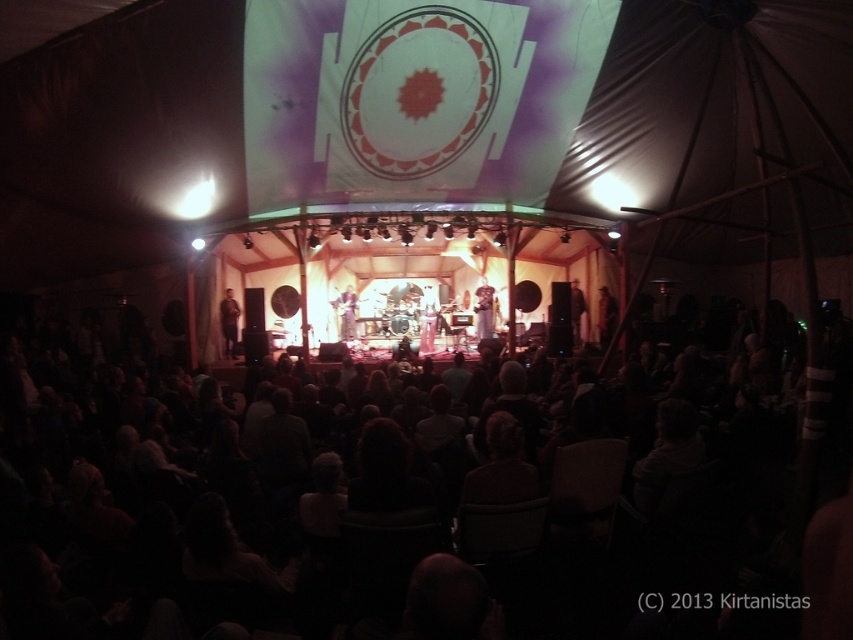
You are a photographer at the concert and want to capture a photo of the silky white dress at center without the dark fabric chairs at center blocking it. Can you move closer to the dress to ensure it fills the frame while avoiding the chairs?

The dark fabric chairs at center are wider than the silky white dress at center, so moving closer might still allow the dress to be framed without the chairs blocking it if positioned correctly.

You are standing at the front of the indoor concert venue and want to take a photo. There are two points of interest marked as point (461, 465) and point (350, 323). Which point is closer to your camera position?

Point (461, 465) is closer to the camera than point (350, 323).

You are a photographer positioned at the back of the audience, aiming to capture a clear shot of both the matte black guitar at left and the silky white dress at center. Which object will appear taller in your photo?

The silky white dress at center will appear taller in the photo since it has a greater height compared to the matte black guitar at left.